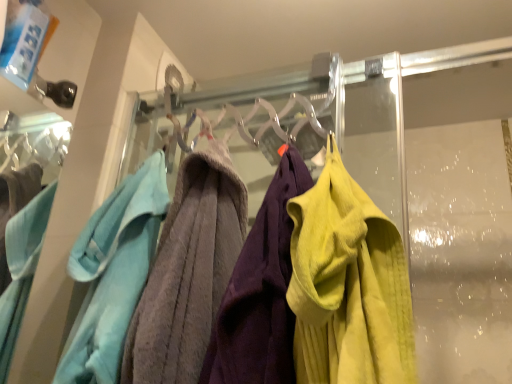
Find the location of a particular element. This screenshot has width=512, height=384. teal fabric towel at left is located at coordinates (113, 273).

What do you see at coordinates (113, 273) in the screenshot? I see `teal fabric towel at left` at bounding box center [113, 273].

The image size is (512, 384). Find the location of `teal fabric towel at left`. teal fabric towel at left is located at coordinates (113, 273).